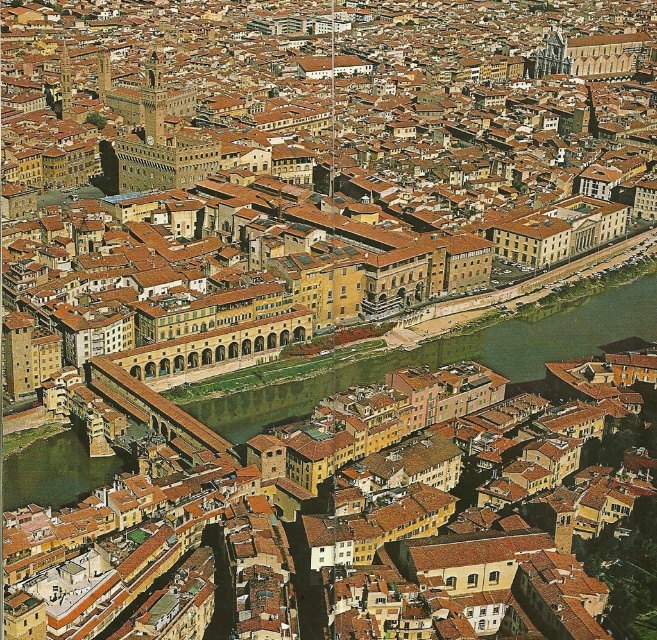
Question: Does matte yellow building at center lie behind matte stone bridge at center?

Choices:
 (A) yes
 (B) no

Answer: (A)

Question: Which of the following is the farthest from the observer?

Choices:
 (A) matte yellow building at center
 (B) matte stone bridge at center

Answer: (A)

Question: Is matte yellow building at center further to the viewer compared to green water at center?

Choices:
 (A) no
 (B) yes

Answer: (B)

Question: Which object is closer to the camera taking this photo?

Choices:
 (A) matte stone bridge at center
 (B) green water at center
 (C) matte yellow building at center

Answer: (A)

Question: Is the position of green water at center less distant than that of matte stone bridge at center?

Choices:
 (A) yes
 (B) no

Answer: (B)

Question: Which object is farther from the camera taking this photo?

Choices:
 (A) matte yellow building at center
 (B) green water at center

Answer: (A)